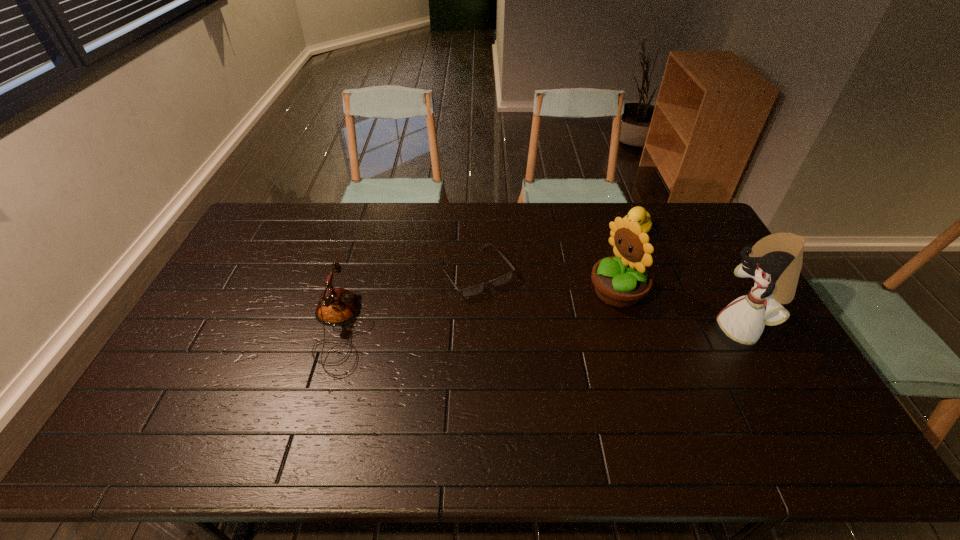
At what (x,y) coordinates should I click in order to perform the action: click on free space that satisfies the following two spatial constraints: 1. on the front side of the duckling; 2. at the front face of the tallest object. Please return your answer as a coordinate pair (x, y). The image size is (960, 540). Looking at the image, I should click on (673, 329).